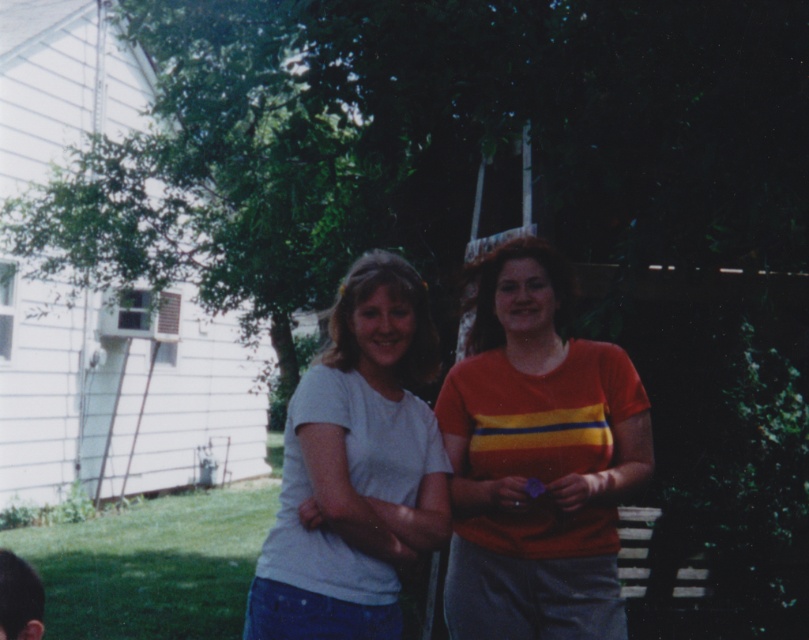
Is orange striped shirt at right further to the viewer compared to dark brown hair at lower left?

Yes, it is behind dark brown hair at lower left.

Which is behind, point (498, 604) or point (5, 620)?

The point (498, 604) is behind.

I want to click on orange striped shirt at right, so click(536, 460).

Is point (582, 586) more distant than point (392, 305)?

Yes.

Is orange striped shirt at right taller than white matte t-shirt at center?

Yes, orange striped shirt at right is taller than white matte t-shirt at center.

The height and width of the screenshot is (640, 809). Describe the element at coordinates (536, 460) in the screenshot. I see `orange striped shirt at right` at that location.

Image resolution: width=809 pixels, height=640 pixels. I want to click on orange striped shirt at right, so click(x=536, y=460).

Who is positioned more to the right, white matte t-shirt at center or dark brown hair at lower left?

white matte t-shirt at center is more to the right.

Can you confirm if white matte t-shirt at center is positioned below dark brown hair at lower left?

No.

Image resolution: width=809 pixels, height=640 pixels. Identify the location of white matte t-shirt at center. tap(356, 467).